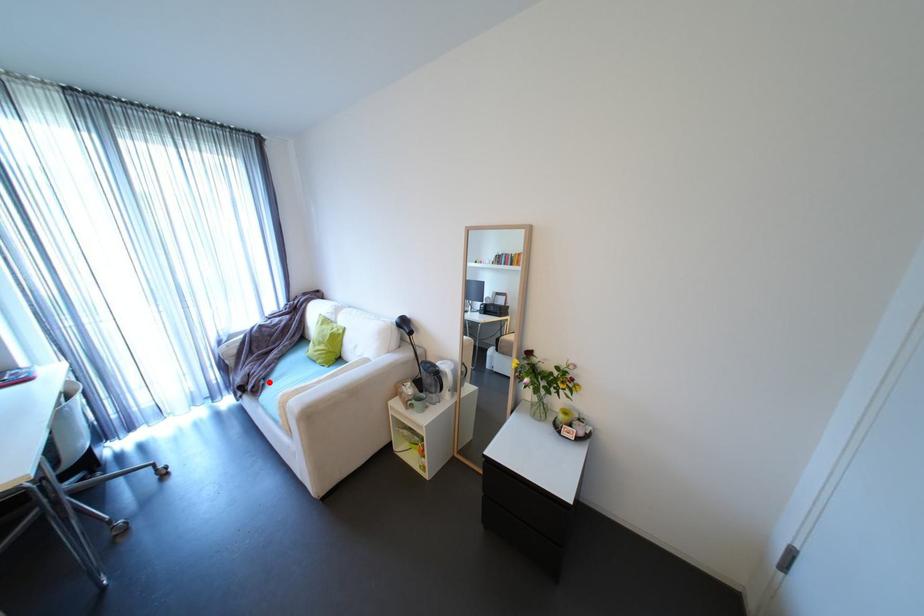
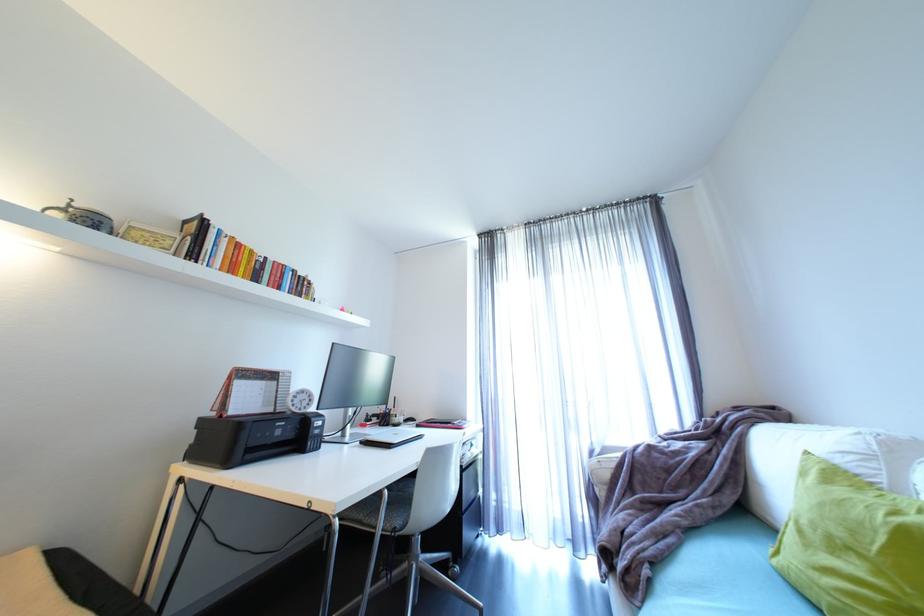
Find the pixel in the second image that matches the highlighted location in the first image.

(653, 572)